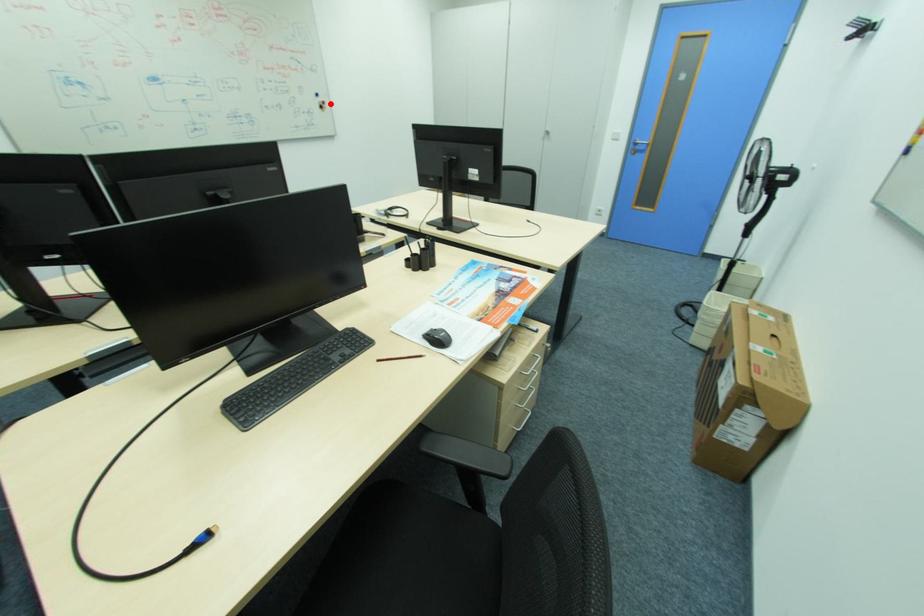
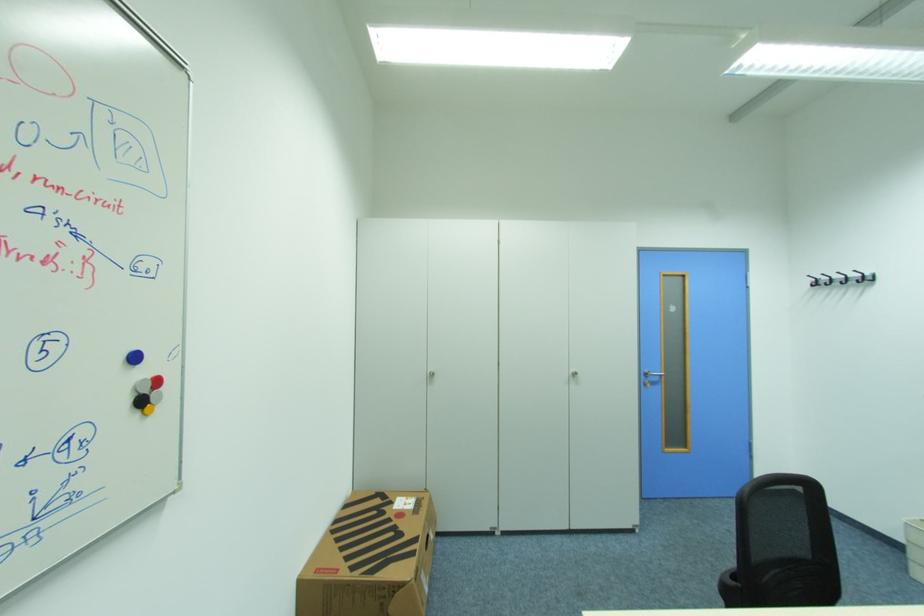
Question: I am providing you with two images of the same scene from different viewpoints. A red point is shown in image1. For the corresponding object point in image2, is it positioned nearer or farther from the camera?

Choices:
 (A) Nearer
 (B) Farther

Answer: (B)